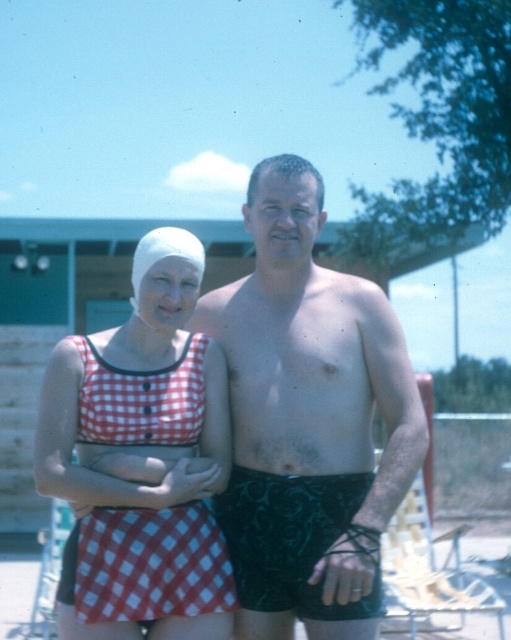
Question: Which object is farther from the camera taking this photo?

Choices:
 (A) red checkered fabric at lower left
 (B) dark green textured shorts at center
 (C) wooden slats beach chair at lower right

Answer: (C)

Question: Is red checkered fabric at lower left further to camera compared to white matte swim cap at upper left?

Choices:
 (A) no
 (B) yes

Answer: (A)

Question: Is dark green textured shorts at center in front of red checkered swimsuit at center?

Choices:
 (A) yes
 (B) no

Answer: (A)

Question: Does red checkered fabric at lower left have a greater width compared to white matte swim cap at upper left?

Choices:
 (A) yes
 (B) no

Answer: (A)

Question: Which of the following is the closest to the observer?

Choices:
 (A) red checkered swimsuit at center
 (B) red checkered fabric at lower left
 (C) wooden slats beach chair at lower right
 (D) white matte swim cap at upper left

Answer: (B)

Question: Which point is farther to the camera?

Choices:
 (A) [x=87, y=589]
 (B) [x=137, y=468]

Answer: (B)